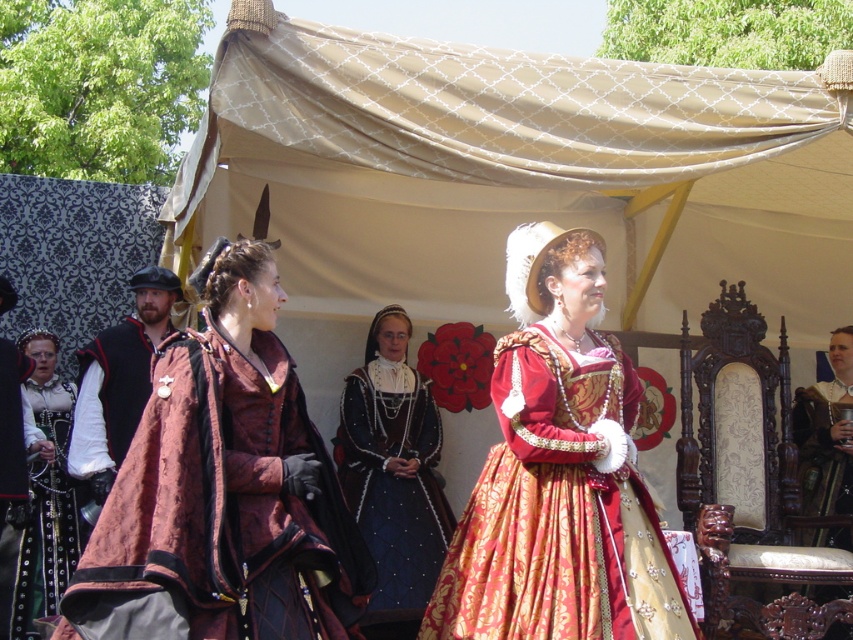
Question: Can you confirm if matte burgundy gown at center is positioned to the right of dark blue satin gown at center?

Choices:
 (A) no
 (B) yes

Answer: (A)

Question: Does gold brocade dress at center have a larger size compared to black leather belt at left?

Choices:
 (A) yes
 (B) no

Answer: (A)

Question: Which point is farther to the camera?

Choices:
 (A) (137, 348)
 (B) (9, 451)

Answer: (A)

Question: Which object is the farthest from the black leather belt at left?

Choices:
 (A) dark blue satin gown at center
 (B) white lace dress at left
 (C) matte gold crown at upper right

Answer: (C)

Question: Which point is farther from the camera taking this photo?

Choices:
 (A) (570, 483)
 (B) (4, 572)

Answer: (B)

Question: Considering the relative positions of dark blue satin gown at center and black leather belt at left in the image provided, where is dark blue satin gown at center located with respect to black leather belt at left?

Choices:
 (A) right
 (B) left

Answer: (A)